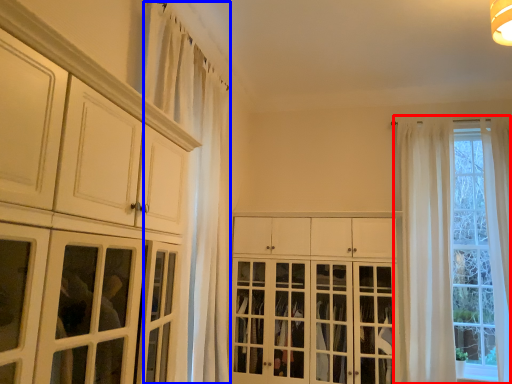
Question: Which object is further to the camera taking this photo, window (highlighted by a red box) or curtain (highlighted by a blue box)?

Choices:
 (A) window
 (B) curtain

Answer: (A)